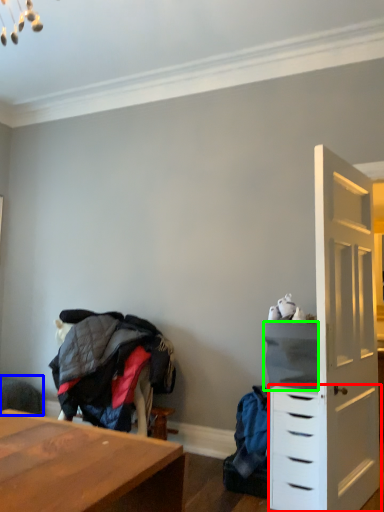
Question: Which object is the closest to the chest of drawers (highlighted by a red box)? Choose among these: swivel chair (highlighted by a blue box) or cabinetry (highlighted by a green box).

Choices:
 (A) swivel chair
 (B) cabinetry

Answer: (B)